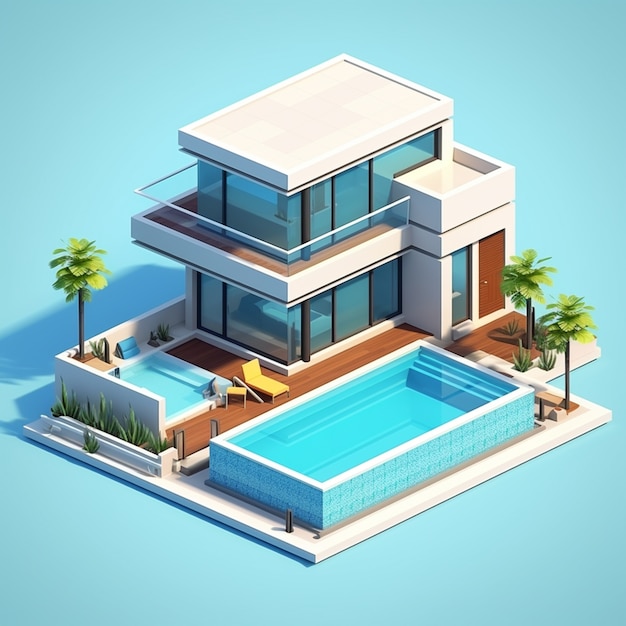
This screenshot has width=626, height=626. I want to click on plant, so click(101, 419).